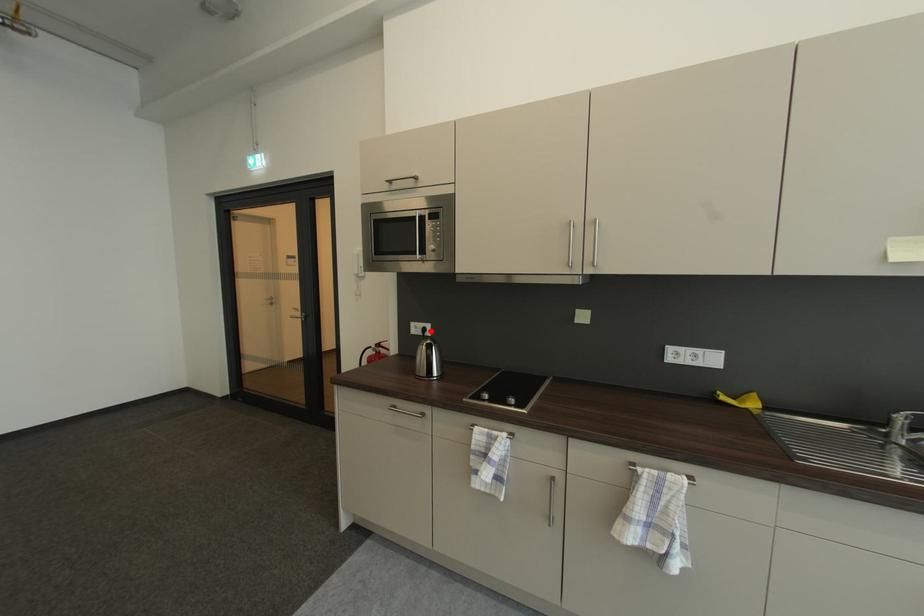
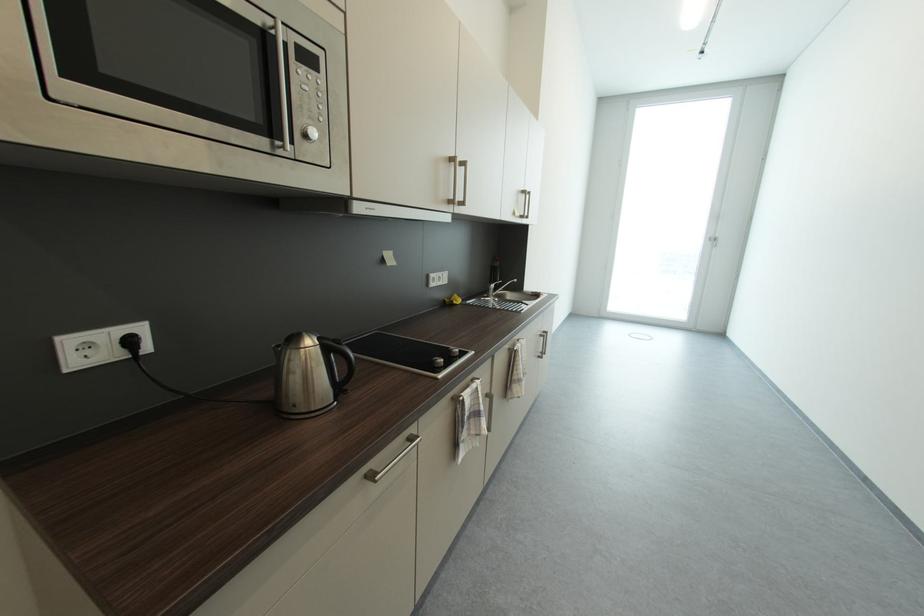
In the second image, find the point that corresponds to the highlighted location in the first image.

(137, 344)